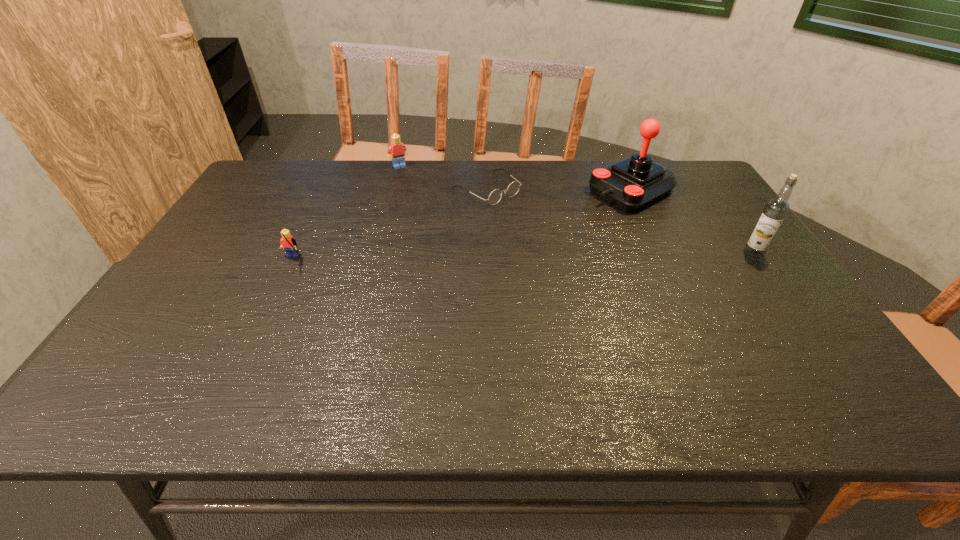
You are a GUI agent. You are given a task and a screenshot of the screen. Output one action in this format:
    pyautogui.click(x=<x>, y=<y>)
    Task: Click on the vacant space located on the label of the rightmost object
    
    Given the screenshot: What is the action you would take?
    pyautogui.click(x=605, y=253)

I want to click on vacant area located 0.210m on the label of the rightmost object, so click(667, 253).

What are the coordinates of `vacant point located 0.060m through the lenses of the spectacles` in the screenshot? It's located at (521, 213).

At what (x,y) coordinates should I click in order to perform the action: click on free location located through the lenses of the spectacles. Please return your answer as a coordinate pair (x, y). Looking at the image, I should click on (536, 222).

The image size is (960, 540). I want to click on vacant space situated through the lenses of the spectacles, so click(575, 249).

Where is `vacant space located on the front-facing side of the right Lego`? The height and width of the screenshot is (540, 960). vacant space located on the front-facing side of the right Lego is located at coordinates pyautogui.click(x=413, y=184).

This screenshot has width=960, height=540. Identify the location of free spot located 0.080m on the front-facing side of the right Lego. (410, 180).

Image resolution: width=960 pixels, height=540 pixels. In order to click on free space located 0.340m on the front-facing side of the right Lego in this screenshot , I will do `click(438, 221)`.

Image resolution: width=960 pixels, height=540 pixels. What are the coordinates of `free space located 0.070m on the base of the joystick` in the screenshot? It's located at (586, 212).

Identify the location of free spot located 0.050m on the base of the joystick. Image resolution: width=960 pixels, height=540 pixels. (590, 210).